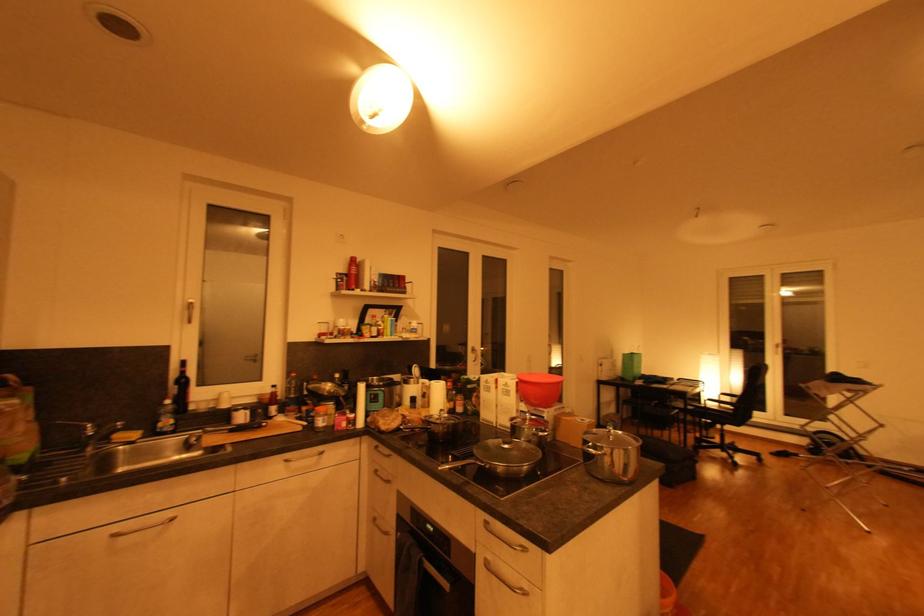
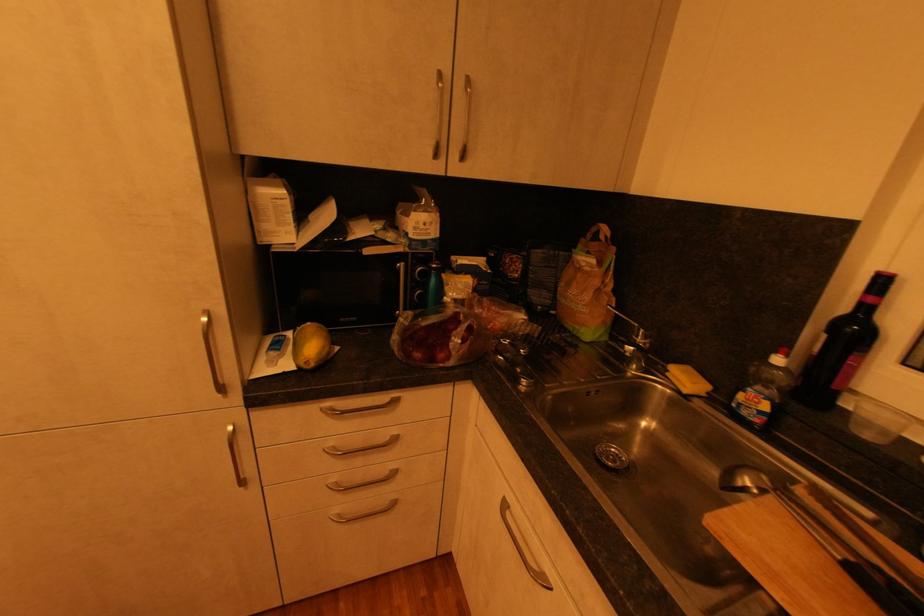
In the second image, find the point that corresponds to pixel 123 535 in the first image.

(508, 507)